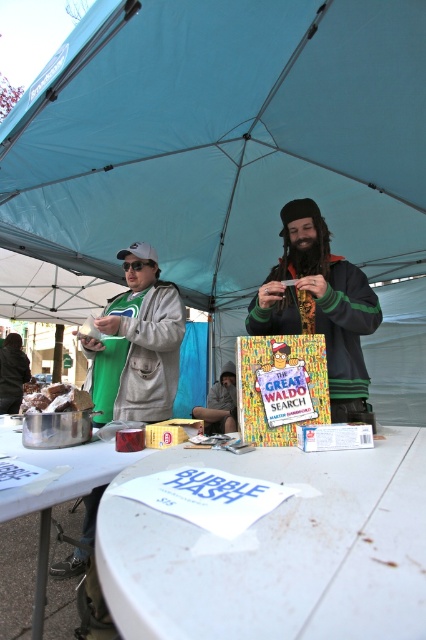
Question: Does blue fabric canopy at upper center have a larger size compared to green fabric jacket at center?

Choices:
 (A) yes
 (B) no

Answer: (A)

Question: Observing the image, what is the correct spatial positioning of dark brown leather jacket at lower left in reference to white crumbly cake at center?

Choices:
 (A) left
 (B) right

Answer: (A)

Question: Considering the real-world distances, which object is closest to the dark brown leather jacket at lower left?

Choices:
 (A) green fabric jacket at left
 (B) green fabric jacket at center
 (C) white matte table at center

Answer: (A)

Question: Is green fabric jacket at center positioned in front of matte plastic book at center?

Choices:
 (A) yes
 (B) no

Answer: (A)

Question: Which point is farther to the camera?

Choices:
 (A) white crumbly cake at center
 (B) green fabric jacket at center

Answer: (B)

Question: Which point is farther from the camera taking this photo?

Choices:
 (A) (353, 115)
 (B) (29, 403)
 (C) (155, 360)

Answer: (A)